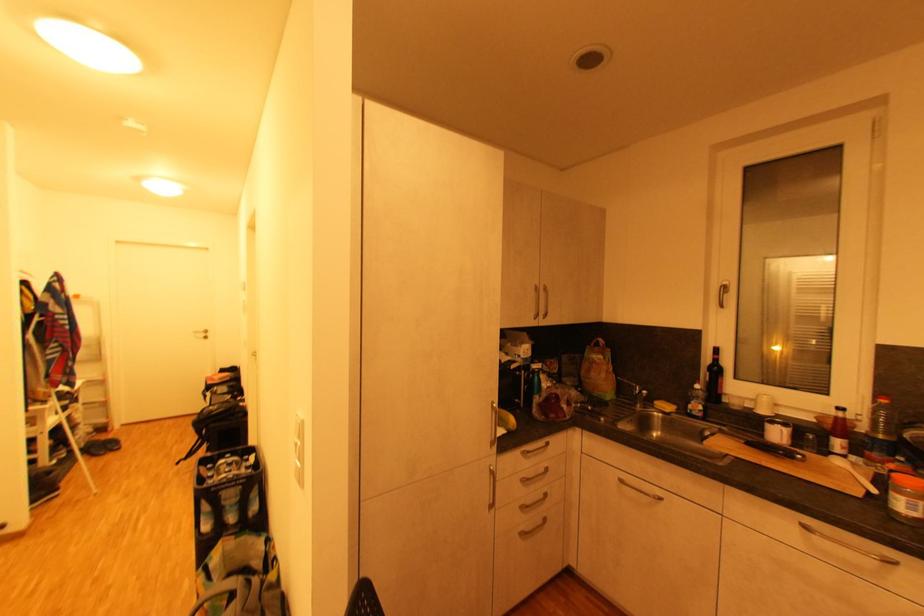
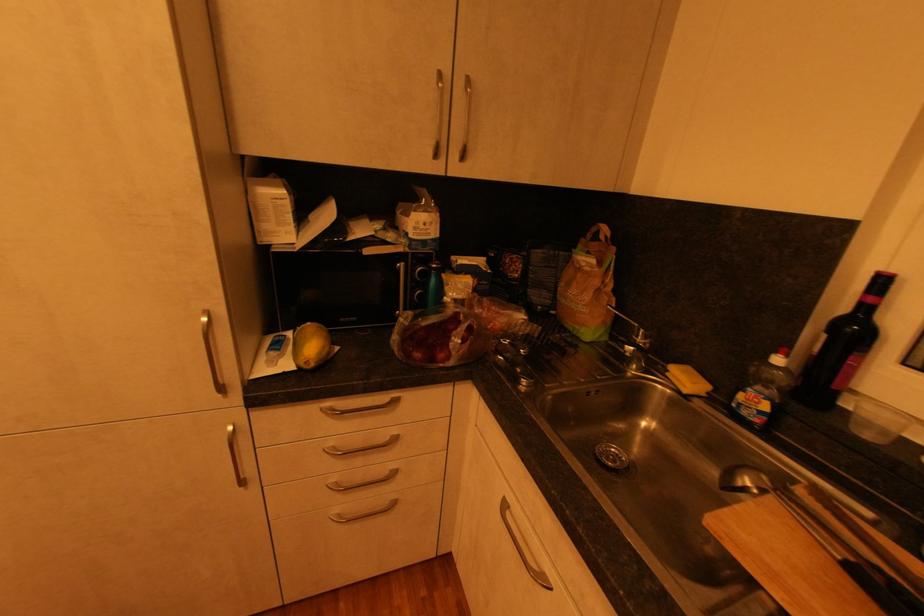
Find the pixel in the second image that matches the point at 712,434 in the first image.

(749, 480)